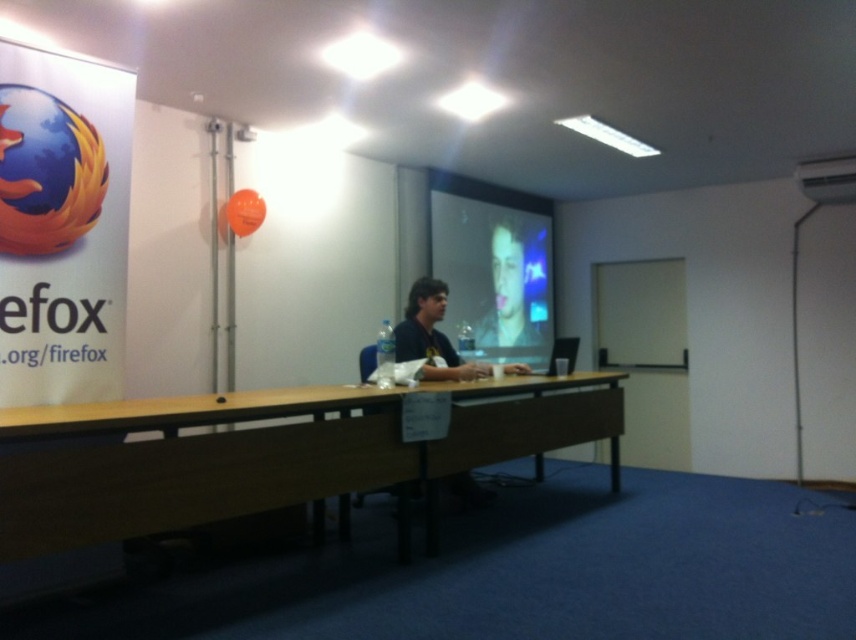
Which is more to the right, matte plastic projector screen at center or smooth skin at center?

smooth skin at center

Locate an element on the screen. matte plastic projector screen at center is located at coordinates (494, 268).

Is dark blue shirt at center shorter than smooth skin at center?

Indeed, dark blue shirt at center has a lesser height compared to smooth skin at center.

Between dark blue shirt at center and smooth skin at center, which one has more height?

smooth skin at center is taller.

At what (x,y) coordinates should I click in order to perform the action: click on dark blue shirt at center. Please return your answer as a coordinate pair (x, y). Looking at the image, I should click on (431, 333).

Which is more to the right, brown wooden table at center or smooth skin at center?

smooth skin at center

What do you see at coordinates (268, 452) in the screenshot? This screenshot has height=640, width=856. I see `brown wooden table at center` at bounding box center [268, 452].

I want to click on brown wooden table at center, so click(268, 452).